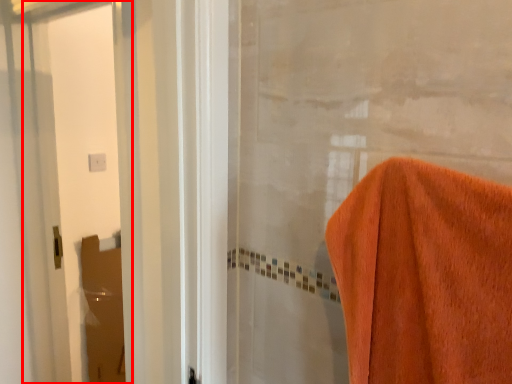
Question: From the image's perspective, where is screen door (annotated by the red box) located relative to screen door?

Choices:
 (A) below
 (B) above

Answer: (B)